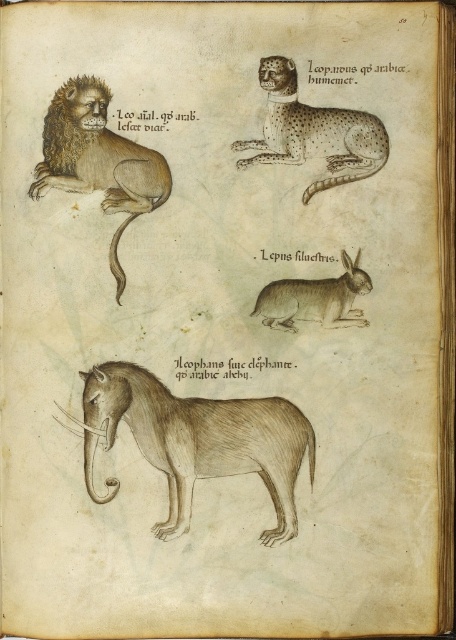
Question: Is brown fur lion at left behind spotted fur cheetah at upper center?

Choices:
 (A) no
 (B) yes

Answer: (A)

Question: Is brown textured elephant at center positioned behind spotted fur cheetah at upper center?

Choices:
 (A) no
 (B) yes

Answer: (A)

Question: Which object is positioned farthest from the brown textured elephant at center?

Choices:
 (A) brown fur lion at left
 (B) spotted fur cheetah at upper center

Answer: (B)

Question: Which object is the closest to the brown fur lion at left?

Choices:
 (A) brown textured rabbit at center
 (B) brown textured elephant at center
 (C) spotted fur cheetah at upper center

Answer: (C)

Question: Is spotted fur cheetah at upper center to the left of brown textured rabbit at center from the viewer's perspective?

Choices:
 (A) yes
 (B) no

Answer: (A)

Question: Based on their relative distances, which object is farther from the spotted fur cheetah at upper center?

Choices:
 (A) brown textured rabbit at center
 (B) brown fur lion at left

Answer: (B)